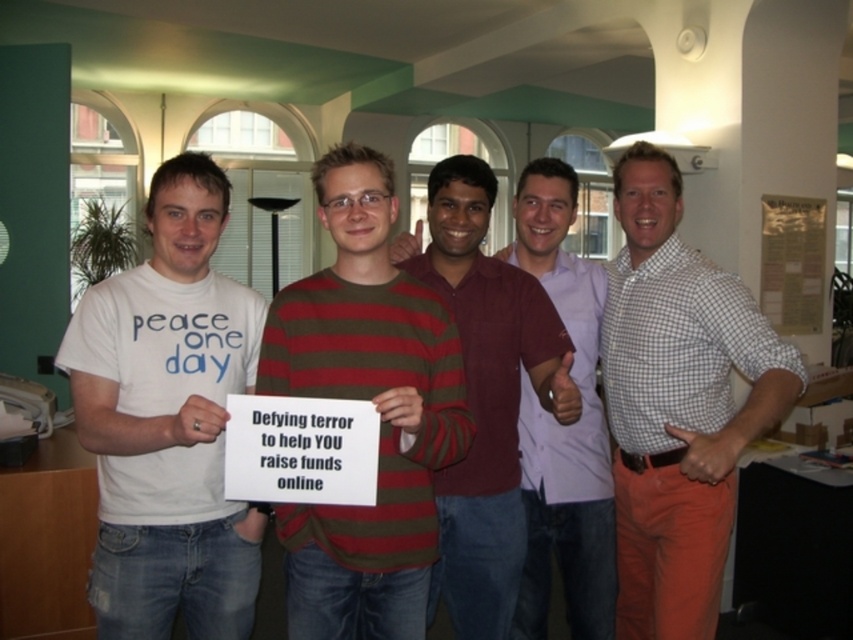
Question: Which of these objects is positioned closest to the maroon striped sweater at center?

Choices:
 (A) striped cotton shirt at center
 (B) white checkered shirt at center

Answer: (A)

Question: Can you confirm if striped cotton shirt at center is bigger than white checkered shirt at center?

Choices:
 (A) no
 (B) yes

Answer: (A)

Question: Is white checkered shirt at center positioned before maroon striped sweater at center?

Choices:
 (A) yes
 (B) no

Answer: (A)

Question: Is white t-shirt at left to the left of light pink shirt at center from the viewer's perspective?

Choices:
 (A) no
 (B) yes

Answer: (B)

Question: Which object is closer to the camera taking this photo?

Choices:
 (A) white checkered shirt at center
 (B) maroon striped sweater at center
 (C) white t-shirt at left
 (D) light pink shirt at center

Answer: (C)

Question: Estimate the real-world distances between objects in this image. Which object is farther from the striped cotton shirt at center?

Choices:
 (A) white checkered shirt at center
 (B) light pink shirt at center
 (C) maroon striped sweater at center
 (D) white t-shirt at left

Answer: (A)